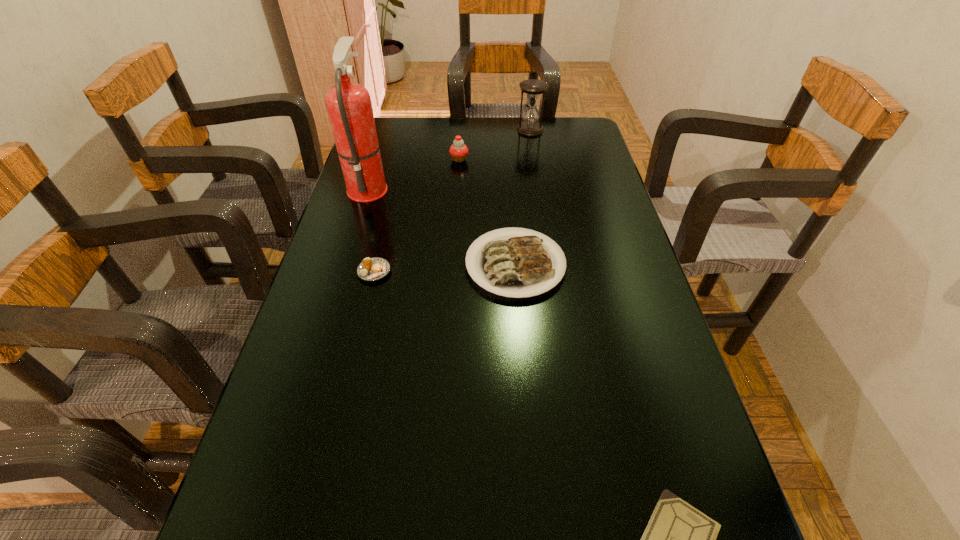
At what (x,y) coordinates should I click in order to perform the action: click on fire extinguisher. Please return your answer as a coordinate pair (x, y). This screenshot has width=960, height=540. Looking at the image, I should click on (349, 107).

Image resolution: width=960 pixels, height=540 pixels. I want to click on the third farthest object, so click(349, 107).

This screenshot has height=540, width=960. Identify the location of the fifth shortest object. (533, 89).

Identify the location of the farthest object. This screenshot has width=960, height=540. [533, 89].

You are a GUI agent. You are given a task and a screenshot of the screen. Output one action in this format:
    pyautogui.click(x=<x>, y=<y>)
    Task: Click on the cupcake
    This screenshot has height=540, width=960.
    Given the screenshot: What is the action you would take?
    pyautogui.click(x=458, y=151)

The width and height of the screenshot is (960, 540). I want to click on the fifth nearest object, so click(458, 151).

Locate an element on the screen. Image resolution: width=960 pixels, height=540 pixels. the fourth tallest object is located at coordinates (514, 267).

Identify the location of pastry. (375, 268).

At what (x,y) coordinates should I click in order to perform the action: click on vacant space located 0.160m with the handle and hose on the tallest object. Please return your answer as a coordinate pair (x, y). Looking at the image, I should click on (443, 187).

Identify the location of free point located 0.160m on the right of the second tallest object. (589, 130).